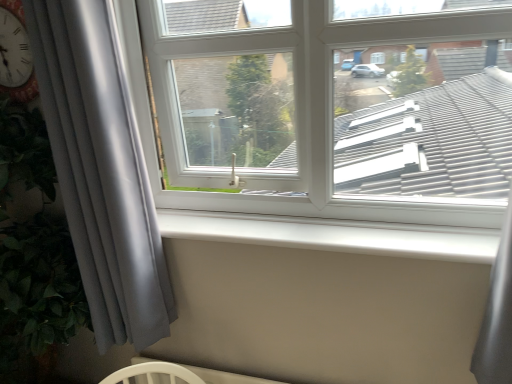
Question: Considering the positions of white smooth window sill at center and gray matte curtain at left in the image, is white smooth window sill at center bigger or smaller than gray matte curtain at left?

Choices:
 (A) big
 (B) small

Answer: (B)

Question: Does point click(x=479, y=246) appear closer or farther from the camera than point click(x=102, y=271)?

Choices:
 (A) closer
 (B) farther

Answer: (A)

Question: Which object is positioned farthest from the white plastic window at center?

Choices:
 (A) white smooth window sill at center
 (B) gray matte curtain at left

Answer: (B)

Question: Which object is positioned farthest from the white smooth window sill at center?

Choices:
 (A) gray matte curtain at left
 (B) white plastic window at center

Answer: (A)